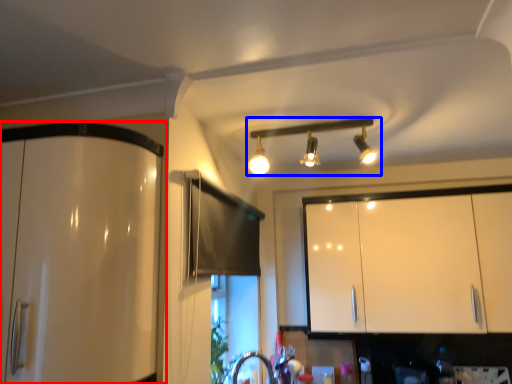
Question: Which object is further to the camera taking this photo, cabinetry (highlighted by a red box) or lamp (highlighted by a blue box)?

Choices:
 (A) cabinetry
 (B) lamp

Answer: (B)